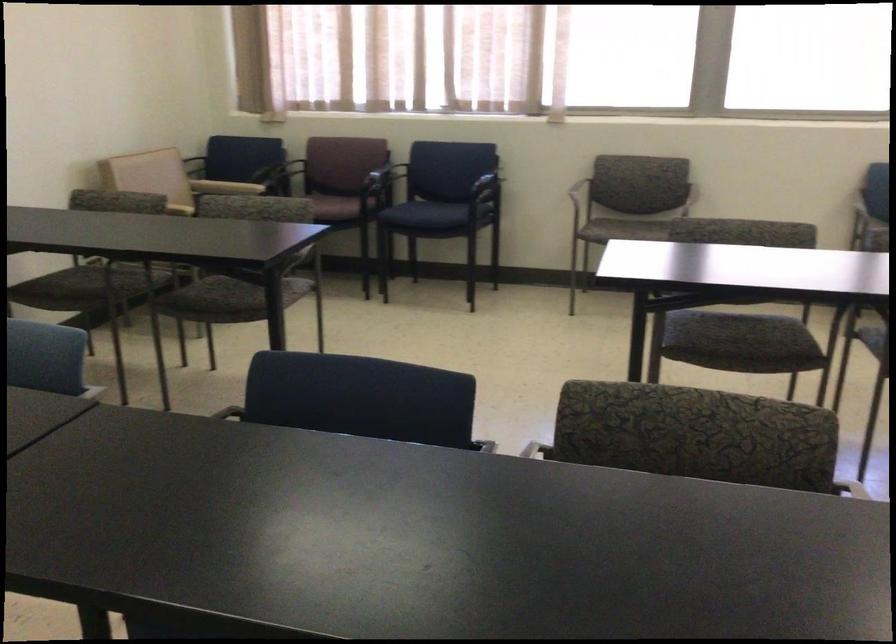
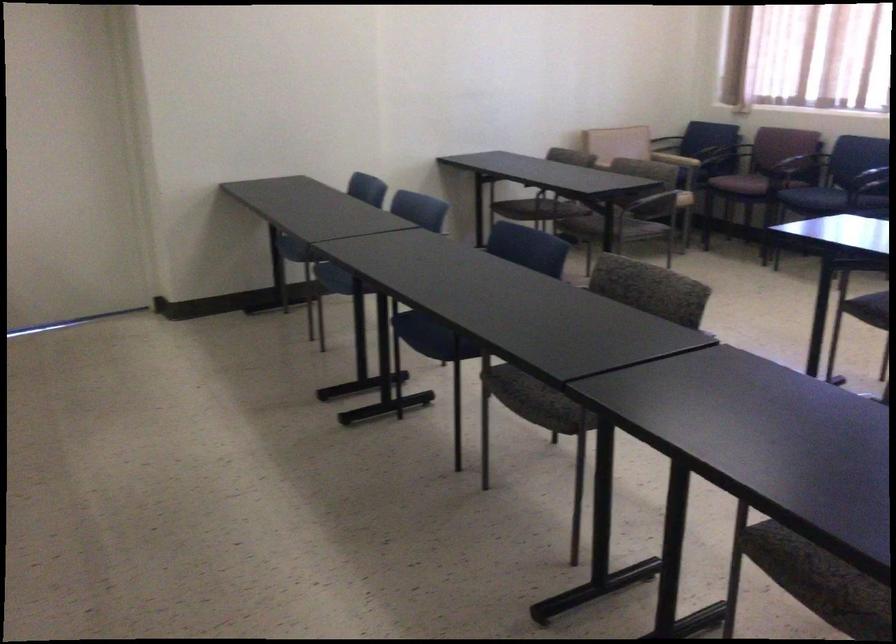
Find the pixel in the second image that matches (x=381, y=176) in the first image.

(800, 160)